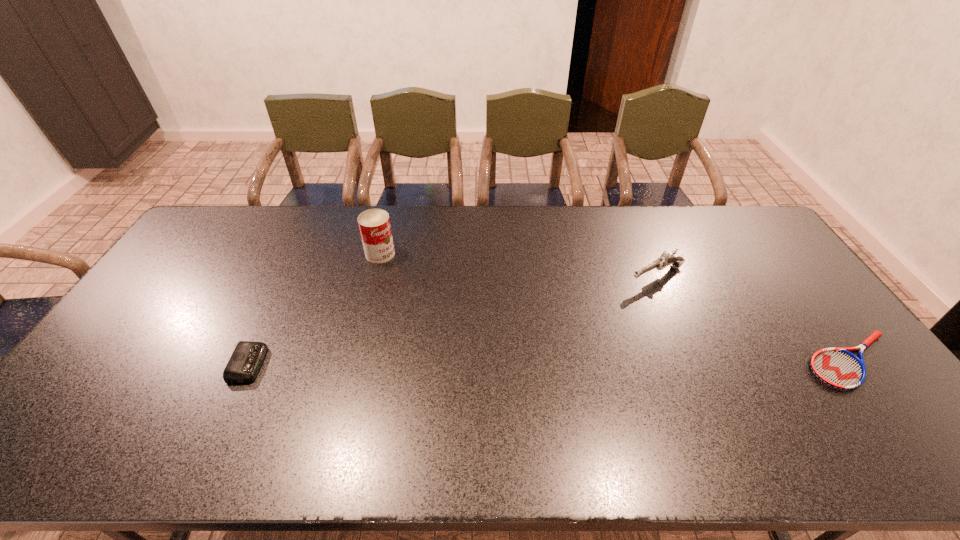
Locate an element on the screen. The image size is (960, 540). free region located 0.380m on the front label of the third object from right to left is located at coordinates (472, 316).

Where is `free space located 0.120m on the front label of the third object from right to left`? The image size is (960, 540). free space located 0.120m on the front label of the third object from right to left is located at coordinates (414, 276).

Where is `vacant region located on the front label of the third object from right to left`? The width and height of the screenshot is (960, 540). vacant region located on the front label of the third object from right to left is located at coordinates (409, 274).

You are a GUI agent. You are given a task and a screenshot of the screen. Output one action in this format:
    pyautogui.click(x=<x>, y=<y>)
    Task: Click on the free space located aimed along the barrel of the third object from left to right
    This screenshot has height=540, width=960.
    Given the screenshot: What is the action you would take?
    pyautogui.click(x=563, y=319)

You are a GUI agent. You are given a task and a screenshot of the screen. Output one action in this format:
    pyautogui.click(x=<x>, y=<y>)
    Task: Click on the free region located aimed along the barrel of the third object from left to right
    The width and height of the screenshot is (960, 540).
    Given the screenshot: What is the action you would take?
    pyautogui.click(x=549, y=326)

Locate an element on the screen. The image size is (960, 540). vacant space located aimed along the barrel of the third object from left to right is located at coordinates (610, 295).

Identify the location of object present at the far edge. This screenshot has height=540, width=960. (374, 224).

Locate an element on the screen. object that is positioned at the near edge is located at coordinates (838, 368).

Find the location of `object at the right edge`. object at the right edge is located at coordinates (838, 368).

Where is `object at the near right corner`? object at the near right corner is located at coordinates (838, 368).